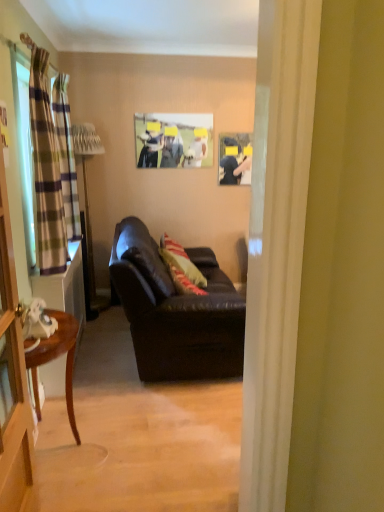
Question: Considering their positions, is plaid fabric curtain at left, the 1th curtain viewed from the back, located in front of or behind metallic silver floor lamp at left?

Choices:
 (A) front
 (B) behind

Answer: (A)

Question: Considering the positions of point (51, 101) and point (76, 131), is point (51, 101) closer or farther from the camera than point (76, 131)?

Choices:
 (A) closer
 (B) farther

Answer: (A)

Question: Which of these objects is positioned closest to the striped fabric pillow at center?

Choices:
 (A) metallic silver floor lamp at left
 (B) leather couch at center
 (C) green plaid curtain at left, positioned as the 2th curtain in back-to-front order
 (D) clear plastic screen door at left
 (E) plaid fabric curtain at left, the 1th curtain viewed from the back

Answer: (B)

Question: Based on their relative distances, which object is nearer to the matte plastic picture frame at upper center?

Choices:
 (A) striped fabric pillow at center
 (B) green plaid curtain at left, positioned as the 2th curtain in back-to-front order
 (C) clear plastic screen door at left
 (D) plaid fabric curtain at left, the 1th curtain viewed from the back
 (E) metallic silver floor lamp at left

Answer: (E)